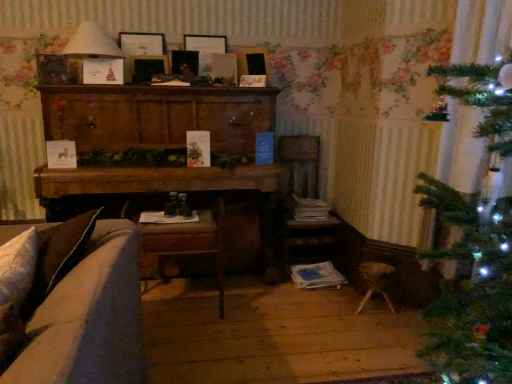
Question: From a real-world perspective, is wooden picture frame at center, marked as the second picture frame in a left-to-right arrangement, beneath matte white lampshade at upper left?

Choices:
 (A) no
 (B) yes

Answer: (B)

Question: Considering the relative positions of wooden picture frame at center, the 3th picture frame positioned from the right, and matte white lampshade at upper left in the image provided, is wooden picture frame at center, the 3th picture frame positioned from the right, to the left of matte white lampshade at upper left from the viewer's perspective?

Choices:
 (A) yes
 (B) no

Answer: (B)

Question: Is wooden picture frame at center, marked as the second picture frame in a left-to-right arrangement, oriented towards matte white lampshade at upper left?

Choices:
 (A) yes
 (B) no

Answer: (B)

Question: From the image's perspective, is wooden picture frame at center, the 3th picture frame positioned from the right, below matte white lampshade at upper left?

Choices:
 (A) yes
 (B) no

Answer: (A)

Question: Is wooden picture frame at center, the 3th picture frame positioned from the right, taller than matte white lampshade at upper left?

Choices:
 (A) no
 (B) yes

Answer: (A)

Question: Is point (96, 46) closer or farther from the camera than point (121, 114)?

Choices:
 (A) closer
 (B) farther

Answer: (A)

Question: Is matte white lampshade at upper left wider or thinner than wooden cabinet at center?

Choices:
 (A) thin
 (B) wide

Answer: (A)

Question: Relative to wooden cabinet at center, is matte white lampshade at upper left in front or behind?

Choices:
 (A) front
 (B) behind

Answer: (B)

Question: Is matte white lampshade at upper left taller or shorter than wooden cabinet at center?

Choices:
 (A) tall
 (B) short

Answer: (B)

Question: Would you say wooden cabinet at center is inside or outside matte wooden picture frame at upper center, the 4th picture frame in the right-to-left sequence?

Choices:
 (A) outside
 (B) inside

Answer: (A)

Question: Considering the positions of wooden cabinet at center and matte wooden picture frame at upper center, the first picture frame viewed from the left, in the image, is wooden cabinet at center bigger or smaller than matte wooden picture frame at upper center, the first picture frame viewed from the left,?

Choices:
 (A) small
 (B) big

Answer: (B)

Question: From the image's perspective, relative to matte wooden picture frame at upper center, the first picture frame viewed from the left, is wooden cabinet at center above or below?

Choices:
 (A) below
 (B) above

Answer: (A)

Question: Does point (132, 99) appear closer or farther from the camera than point (119, 41)?

Choices:
 (A) closer
 (B) farther

Answer: (A)

Question: Considering their positions, is wooden picture frame at upper center, marked as the 3th picture frame in a left-to-right arrangement, located in front of or behind matte wooden picture frame at upper center, which appears as the fourth picture frame when viewed from the left?

Choices:
 (A) behind
 (B) front

Answer: (A)

Question: Is wooden picture frame at upper center, the second picture frame in the right-to-left sequence, taller or shorter than matte wooden picture frame at upper center, which is counted as the 1th picture frame, starting from the right?

Choices:
 (A) tall
 (B) short

Answer: (A)